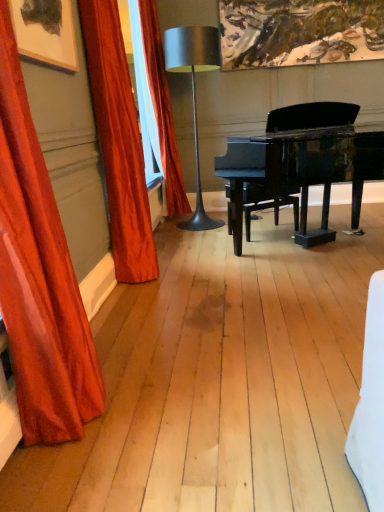
Image resolution: width=384 pixels, height=512 pixels. In order to click on vacant space in black polished piano at center (from a real-world perspective) in this screenshot , I will do `click(325, 265)`.